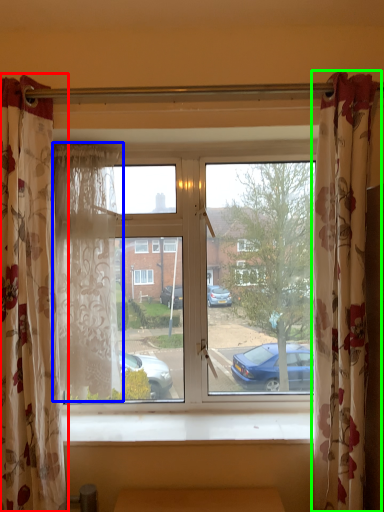
Question: Considering the real-world distances, which object is farthest from curtain (highlighted by a red box)? curtain (highlighted by a blue box) or curtain (highlighted by a green box)?

Choices:
 (A) curtain
 (B) curtain

Answer: (B)